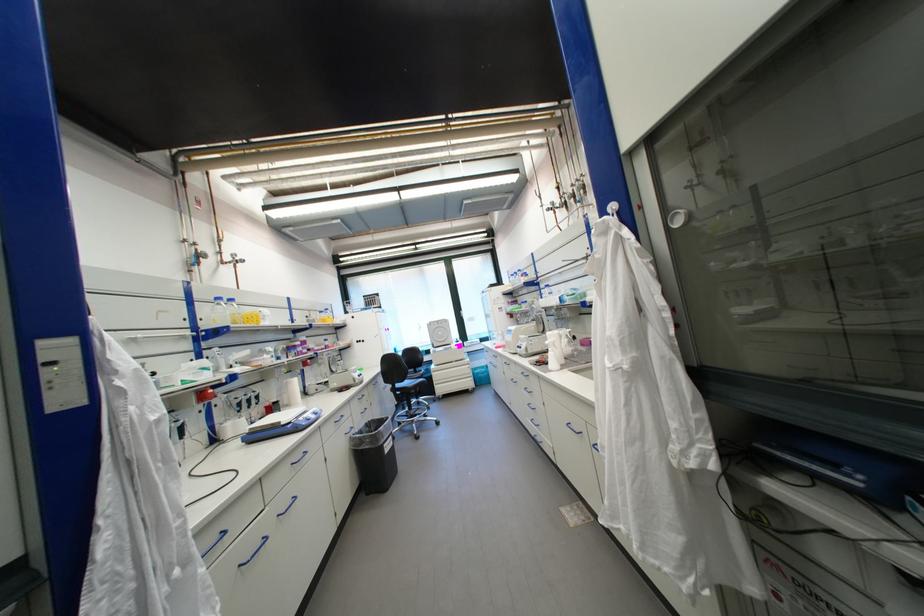
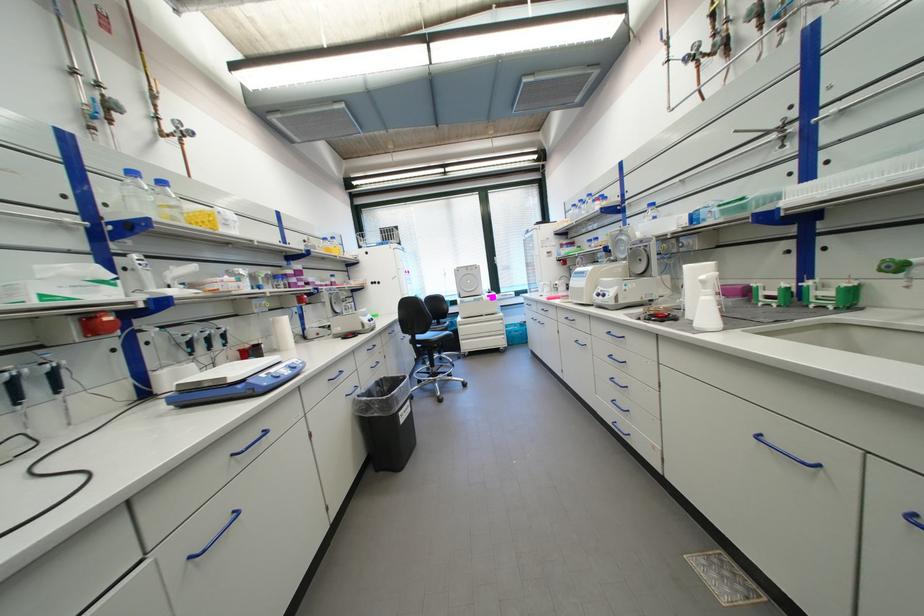
Find the pixel in the second image that matches the point at 406,387 in the first image.

(427, 338)